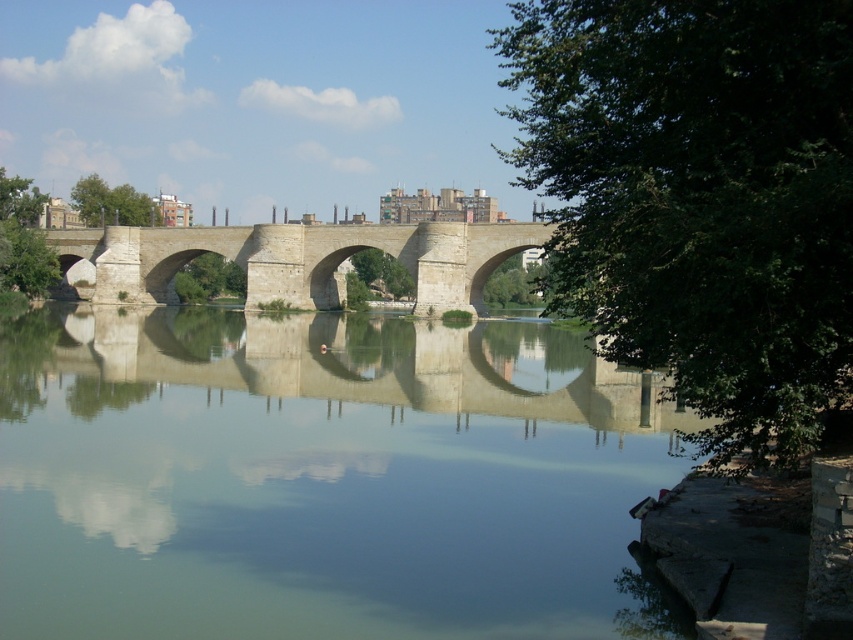
Which of these two, greenish water at center or stone bridge at center, stands taller?

greenish water at center

Can you confirm if greenish water at center is positioned to the left of stone bridge at center?

Incorrect, greenish water at center is not on the left side of stone bridge at center.

Based on the photo, who is more distant from viewer, (614, 413) or (434, 228)?

The point (434, 228) is behind.

The height and width of the screenshot is (640, 853). Find the location of `greenish water at center`. greenish water at center is located at coordinates [x=322, y=477].